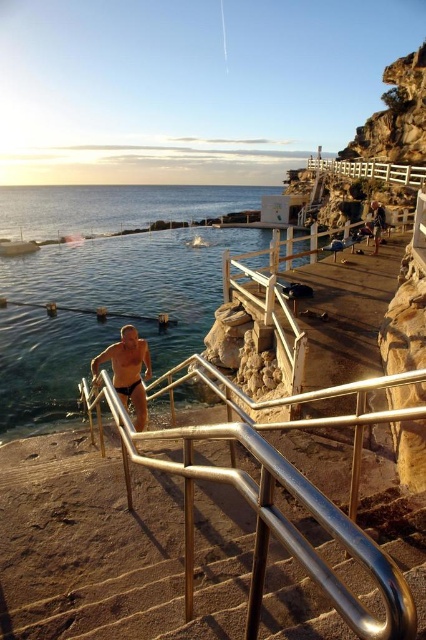
You are a tourist visiting the coast and want to take a photo of the silver metallic handrail at center and the matte black swim trunks at lower center. Based on their positions, which object is closer to the camera?

The matte black swim trunks at lower center are closer to the camera because the silver metallic handrail at center is positioned below them, indicating it is farther away.

You are standing at the edge of the natural pool and want to grab the silver metallic handrail at center for support. Based on its position, can you estimate how far it is from your current position?

The silver metallic handrail at center is located at point (273, 500), which means it is positioned to the right and slightly below your current position at the pool edge. You can reach it by moving towards that direction.